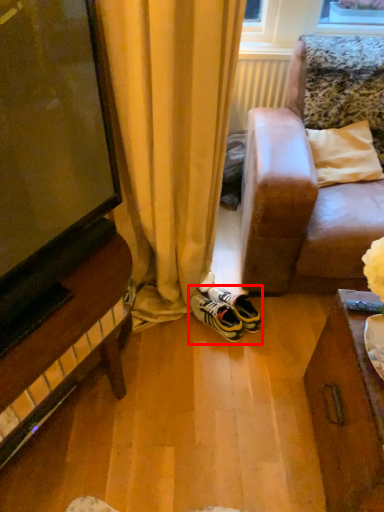
Question: From the image's perspective, where is footwear (annotated by the red box) located in relation to radiator in the image?

Choices:
 (A) above
 (B) below

Answer: (B)